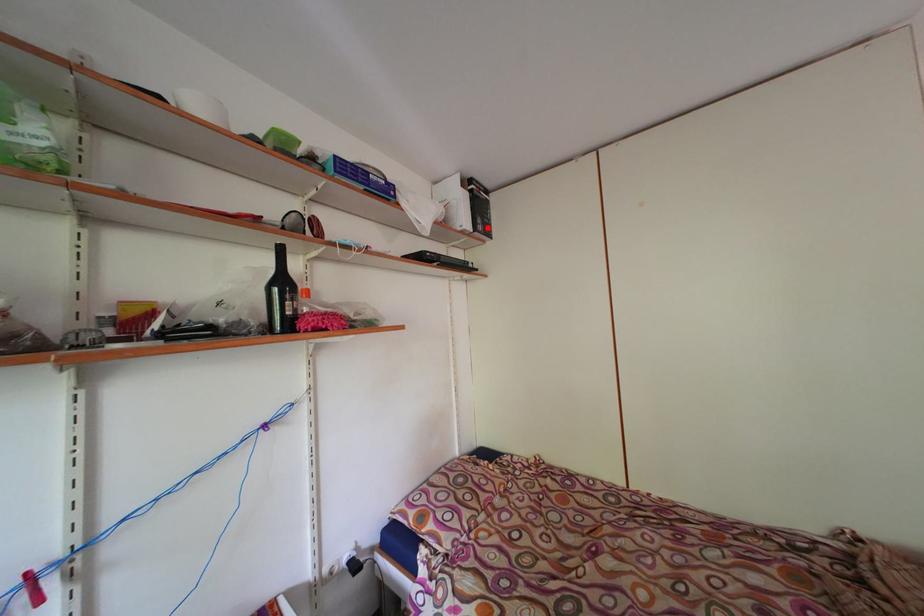
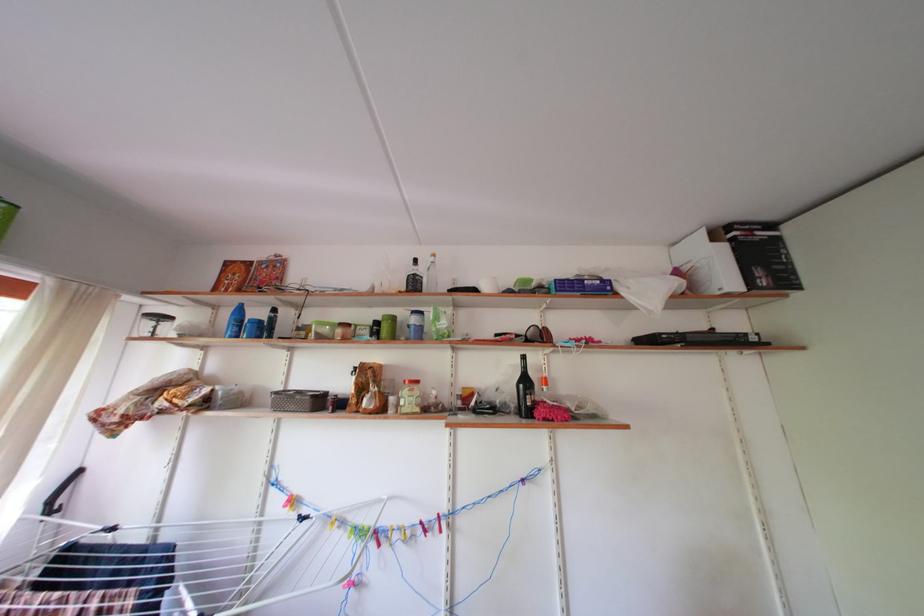
The point at the highlighted location is marked in the first image. Where is the corresponding point in the second image?

(768, 278)